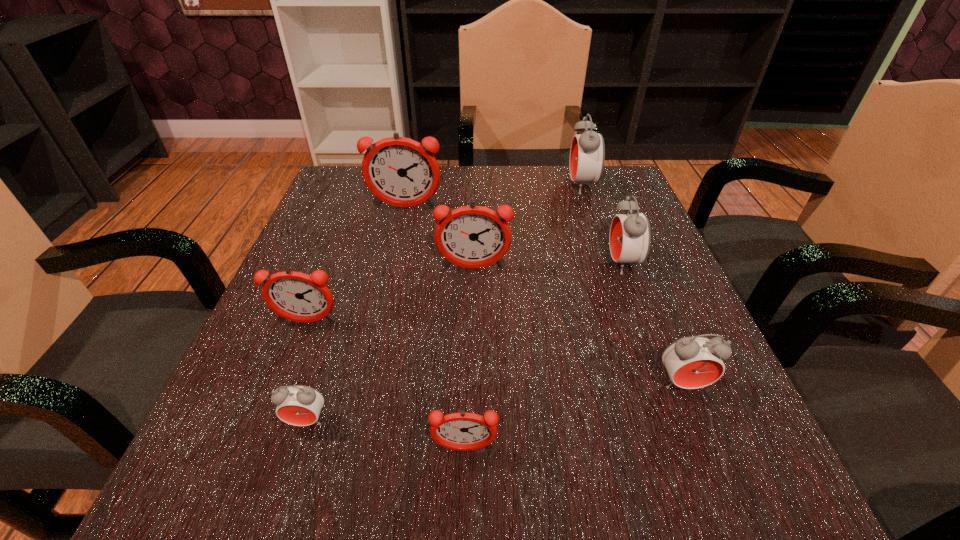
This screenshot has width=960, height=540. What are the coordinates of `vacant region between the second biggest reddish-pink alarm clock and the third farthest red alarm clock` in the screenshot? It's located at (578, 326).

Identify which object is the closest to the leftmost red alarm clock. Please provide its 2D coordinates. Your answer should be formatted as a tuple, i.e. [(x, y)], where the tuple contains the x and y coordinates of a point satisfying the conditions above.

[(463, 431)]

Image resolution: width=960 pixels, height=540 pixels. I want to click on object that is the sixth closest to the nearest alarm clock, so click(x=400, y=171).

Point out which alarm clock is positioned as the second nearest to the second biggest reddish-pink alarm clock. Please provide its 2D coordinates. Your answer should be formatted as a tuple, i.e. [(x, y)], where the tuple contains the x and y coordinates of a point satisfying the conditions above.

[(296, 296)]

Locate an element on the screen. alarm clock that stands as the fourth closest to the farthest alarm clock is located at coordinates (693, 362).

At what (x,y) coordinates should I click in order to perform the action: click on the second closest red alarm clock relative to the third nearest reddish-pink alarm clock. Please return your answer as a coordinate pair (x, y). The image size is (960, 540). Looking at the image, I should click on (587, 154).

This screenshot has height=540, width=960. In order to click on red alarm clock that is the third nearest to the third biggest reddish-pink alarm clock in this screenshot , I will do `click(693, 362)`.

Where is `the third closest reddish-pink alarm clock to the biggest red alarm clock`? The image size is (960, 540). the third closest reddish-pink alarm clock to the biggest red alarm clock is located at coordinates (296, 296).

This screenshot has height=540, width=960. In order to click on reddish-pink alarm clock that stands as the closest to the second biggest reddish-pink alarm clock in this screenshot , I will do `click(400, 171)`.

Where is `vacant region that satisfies the following two spatial constraints: 1. on the face of the farthest alarm clock; 2. on the front-facing side of the farthest reddish-pink alarm clock`? This screenshot has width=960, height=540. vacant region that satisfies the following two spatial constraints: 1. on the face of the farthest alarm clock; 2. on the front-facing side of the farthest reddish-pink alarm clock is located at coordinates pos(588,207).